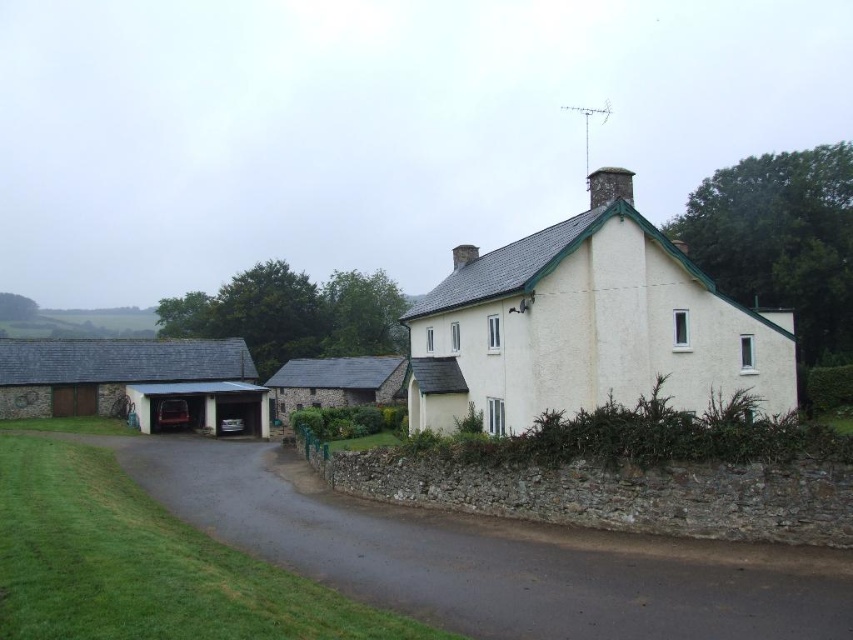
You are standing at the base of the dark gray stone chimney at upper center and want to walk to the dark gray asphalt at lower center. Is the path downhill or uphill?

The dark gray asphalt at lower center has a lesser height compared to the dark gray stone chimney at upper center, so the path from the dark gray stone chimney at upper center to the dark gray asphalt at lower center is downhill.

You are a delivery person with a 2.5 meter wide truck. You need to park your truck between the dark gray asphalt at lower center and the stone building to the left of the main house. Is there enough space?

The distance between the dark gray asphalt at lower center and the stone building to the left of the main house is 9.91 meters. Since the truck is 2.5 meters wide, there is sufficient space to park the truck between them as 9.91 meters is greater than 2.5 meters.